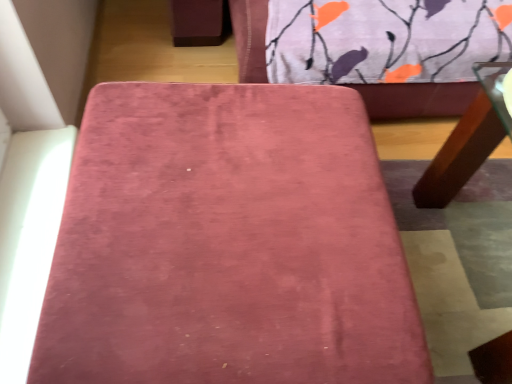
This screenshot has height=384, width=512. I want to click on velvet-like pink ottoman at center, so click(x=227, y=244).

What do you see at coordinates (227, 244) in the screenshot? I see `velvet-like pink ottoman at center` at bounding box center [227, 244].

What is the approximate width of velvet-like pink ottoman at center?

The width of velvet-like pink ottoman at center is 28.30 inches.

Where is `velvet-like pink ottoman at center`? This screenshot has height=384, width=512. velvet-like pink ottoman at center is located at coordinates (227, 244).